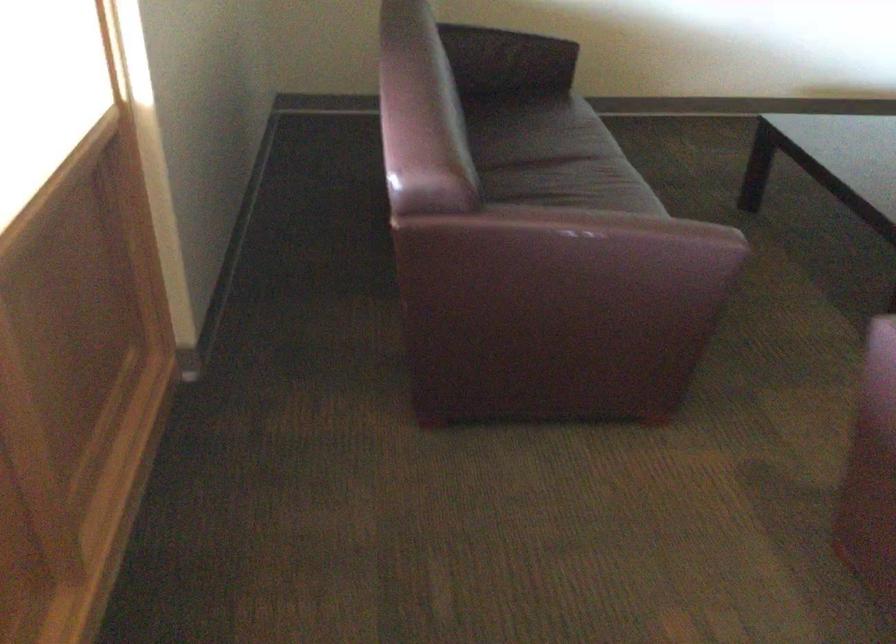
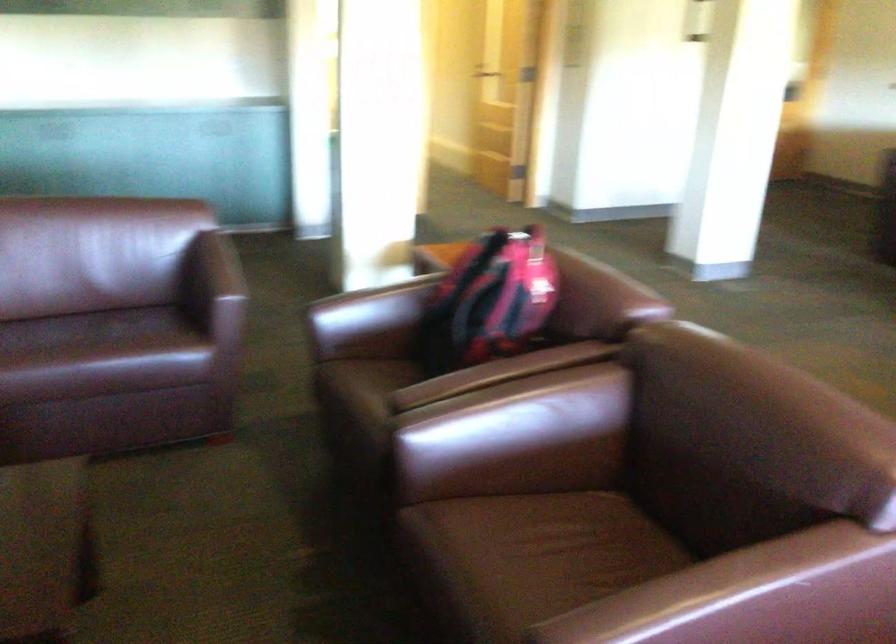
The images are taken continuously from a first-person perspective. In which direction is your viewpoint rotating?

The camera's rotation is toward right-down.